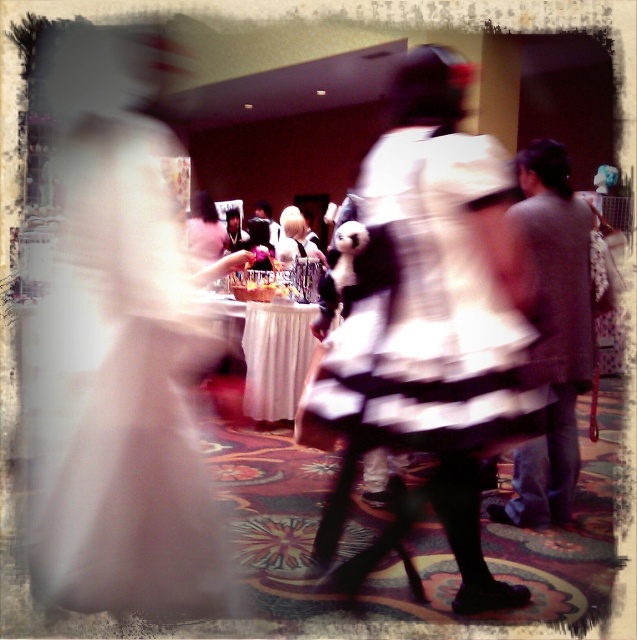
Question: Which of the following is the farthest from the observer?

Choices:
 (A) white satin dress at left
 (B) white striped dress at center
 (C) blonde hair at center

Answer: (C)

Question: Where is white striped dress at center located in relation to blonde hair at center in the image?

Choices:
 (A) above
 (B) below

Answer: (B)

Question: Is white satin dress at left to the right of dark gray suit at right from the viewer's perspective?

Choices:
 (A) no
 (B) yes

Answer: (A)

Question: Which object appears farthest from the camera in this image?

Choices:
 (A) dark gray suit at right
 (B) blonde hair at center
 (C) white satin dress at left

Answer: (B)

Question: Estimate the real-world distances between objects in this image. Which object is closer to the blonde hair at center?

Choices:
 (A) white satin dress at left
 (B) white striped dress at center
 (C) dark gray suit at right

Answer: (C)

Question: Does white satin dress at left have a greater width compared to white striped dress at center?

Choices:
 (A) no
 (B) yes

Answer: (B)